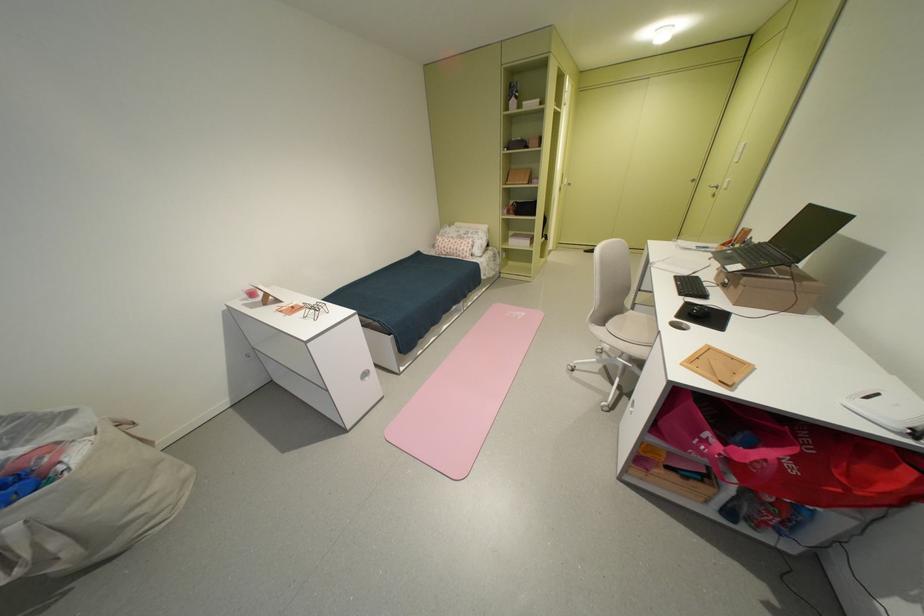
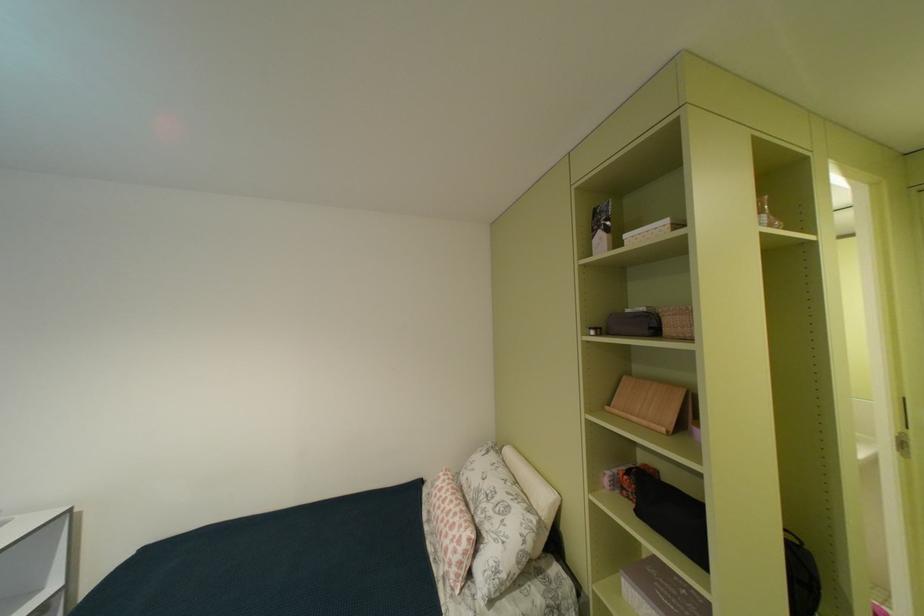
Find the pixel in the second image that matches (548,102) in the first image.

(676, 223)